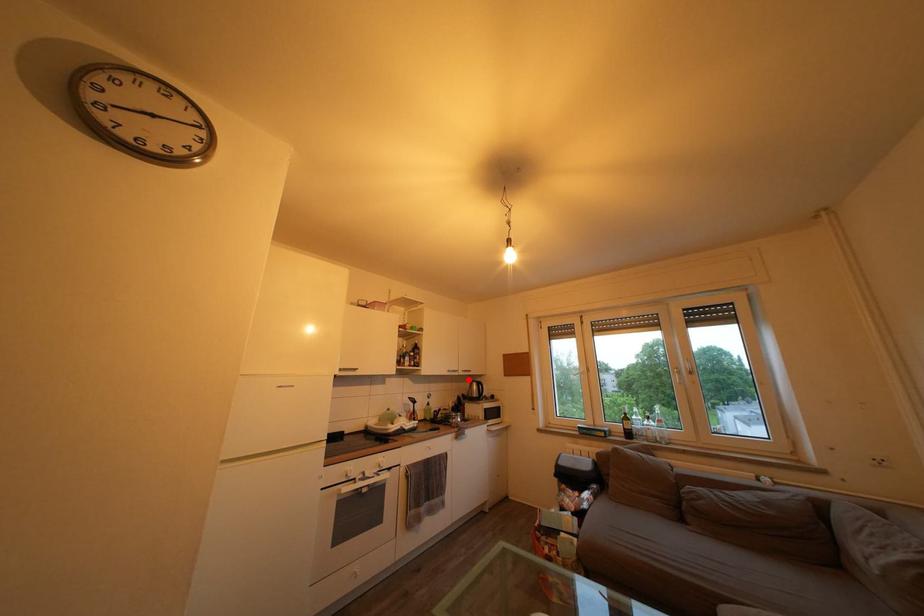
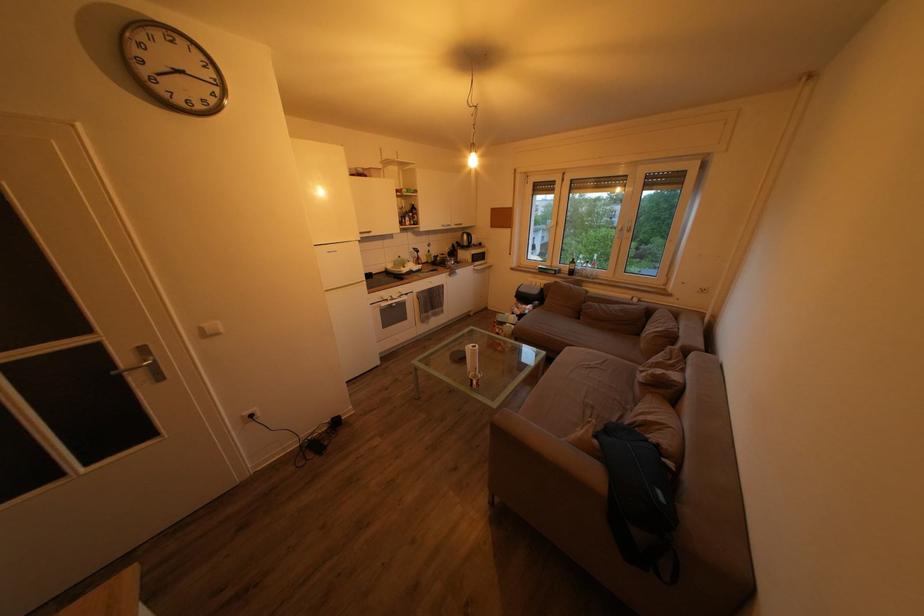
In the second image, find the point that corresponds to the highlighted location in the first image.

(462, 233)